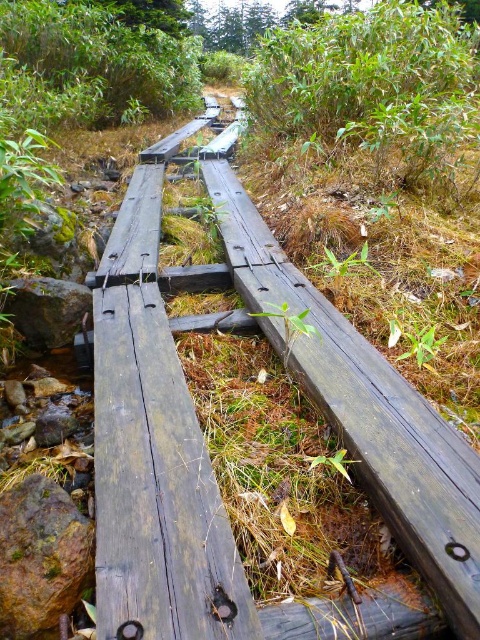
Who is taller, weathered wood rail at center or green mossy rock at center-left?

Standing taller between the two is weathered wood rail at center.

Is point (222, 173) positioned in front of point (78, 577)?

No.

Locate an element on the screen. The height and width of the screenshot is (640, 480). weathered wood rail at center is located at coordinates (202, 435).